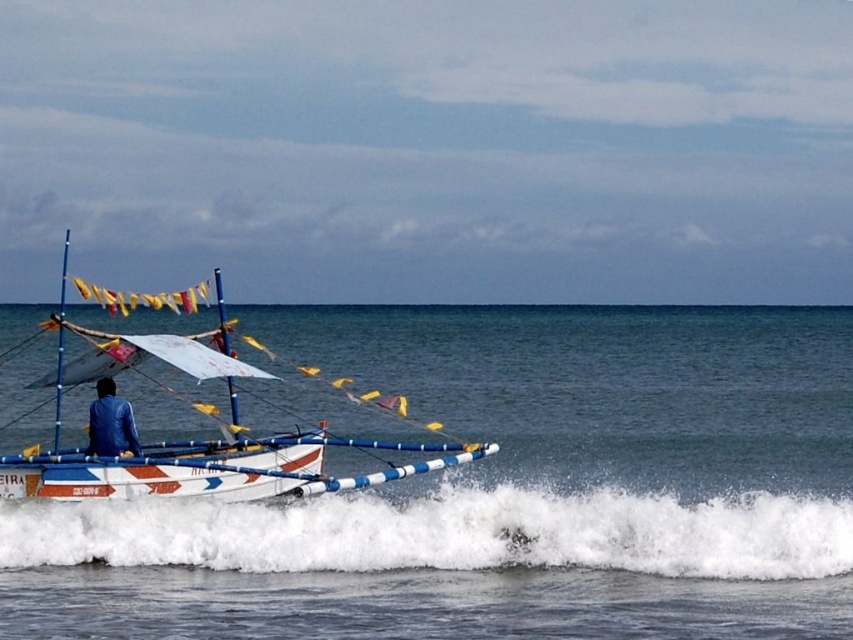
Is white plastic boat at left positioned in front of blue fabric jacket at left?

Yes, white plastic boat at left is in front of blue fabric jacket at left.

From the picture: Can you confirm if white plastic boat at left is positioned above blue fabric jacket at left?

Yes, white plastic boat at left is above blue fabric jacket at left.

Who is more forward, [228,372] or [109,387]?

Point [228,372]

Identify the location of white plastic boat at left. This screenshot has width=853, height=640. (196, 440).

Can you confirm if white frothy wave at lower center is positioned to the left of white plastic boat at left?

Incorrect, white frothy wave at lower center is not on the left side of white plastic boat at left.

Who is higher up, white frothy wave at lower center or white plastic boat at left?

white plastic boat at left is higher up.

Who is more distant from viewer, [775,536] or [322,467]?

The point [322,467] is more distant.

I want to click on white frothy wave at lower center, so click(451, 532).

Does white frothy water at lower center appear on the left side of blue fabric jacket at left?

Yes, white frothy water at lower center is to the left of blue fabric jacket at left.

Does white frothy water at lower center have a smaller size compared to blue fabric jacket at left?

No.

What do you see at coordinates (506, 492) in the screenshot? Image resolution: width=853 pixels, height=640 pixels. I see `white frothy water at lower center` at bounding box center [506, 492].

At what (x,y) coordinates should I click in order to perform the action: click on white frothy water at lower center. Please return your answer as a coordinate pair (x, y). The image size is (853, 640). Looking at the image, I should click on (506, 492).